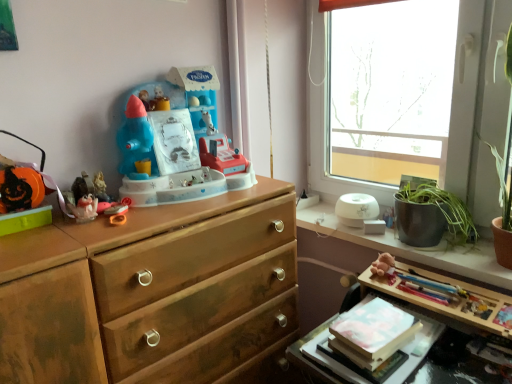
In order to click on free space above white glossy humidifier at upper right (from a real-world perspective) in this screenshot , I will do `click(380, 229)`.